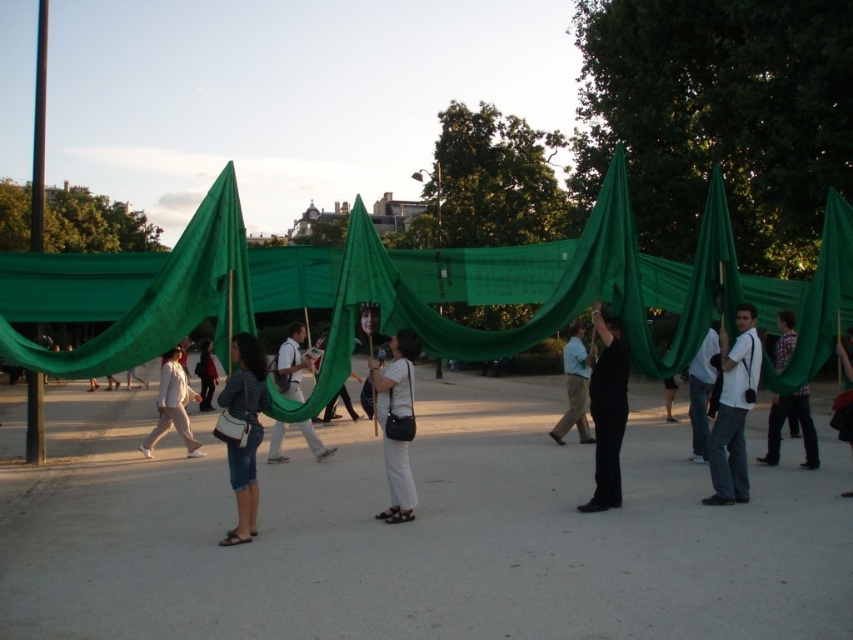
You are organizing a picnic and need to place your items. You have a white matte bag at center and a light brown fabric at center. According to the scene, which item is positioned to the left?

The white matte bag at center is to the left of the light brown fabric at center, so the white matte bag at center is positioned to the left.

You are a photographer standing in the park scene and want to take a photo of the white fabric backpack at center and the white cotton jacket at center. Which object should you adjust your camera focus on first if you want to capture both clearly in the same frame?

The white fabric backpack at center is to the right of the white cotton jacket at center, so you should focus on the white cotton jacket at center first since it is closer to the camera, ensuring both are in focus as you adjust the depth of field.

Consider the image. You are standing in the park and see two points marked in the image. Which point is closer to you, point (570,346) or point (851,442)?

Point (570,346) is closer to you because it is further to the viewer than point (851,442).